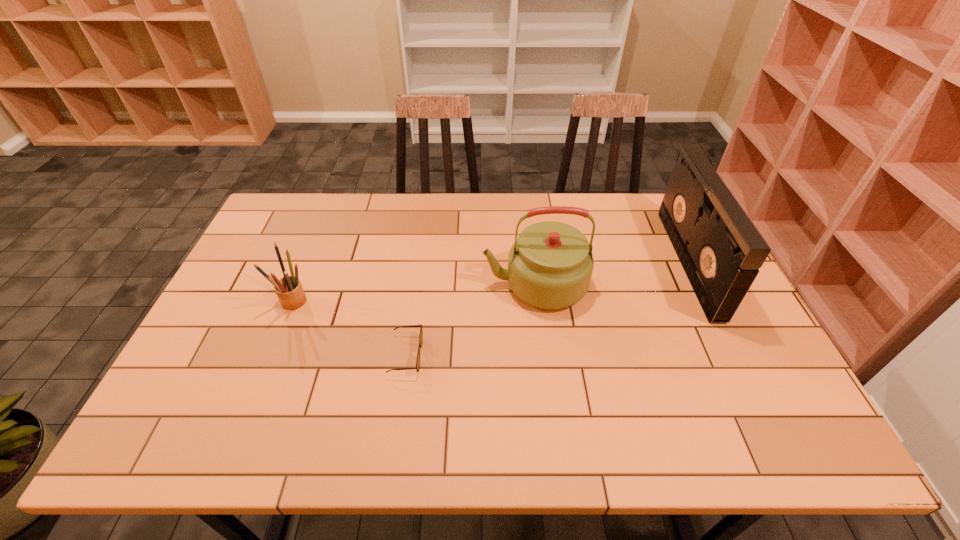
You are a GUI agent. You are given a task and a screenshot of the screen. Output one action in this format:
    pyautogui.click(x=<x>, y=<y>)
    Task: Click on the empty location between the third object from left to right and the nearest object
    
    Given the screenshot: What is the action you would take?
    pyautogui.click(x=470, y=319)

Locate an element on the screen. Image resolution: width=960 pixels, height=540 pixels. object that is the third nearest to the nearest object is located at coordinates (721, 251).

Choose which object is the nearest neighbor to the rightmost object. Please provide its 2D coordinates. Your answer should be formatted as a tuple, i.e. [(x, y)], where the tuple contains the x and y coordinates of a point satisfying the conditions above.

[(550, 265)]

Where is `free space that satisfies the following two spatial constraints: 1. at the spout of the second object from right to left; 2. on the front side of the second shortest object`? free space that satisfies the following two spatial constraints: 1. at the spout of the second object from right to left; 2. on the front side of the second shortest object is located at coordinates (537, 301).